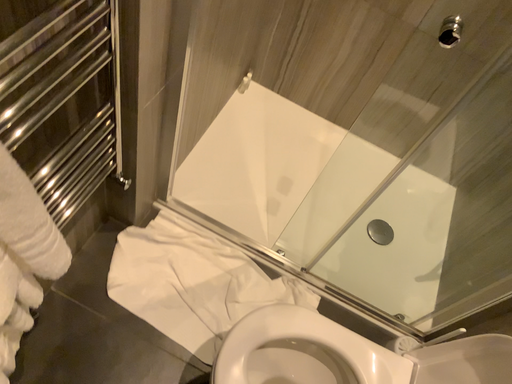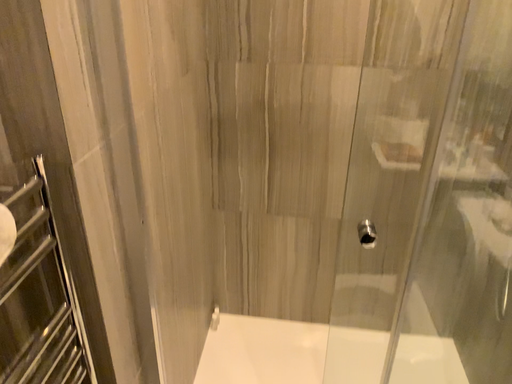
Question: How did the camera likely rotate when shooting the video?

Choices:
 (A) rotated downward
 (B) rotated upward

Answer: (B)